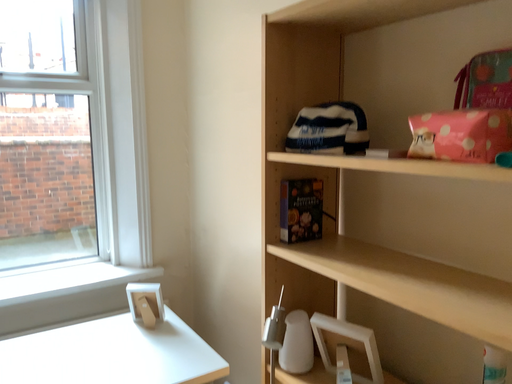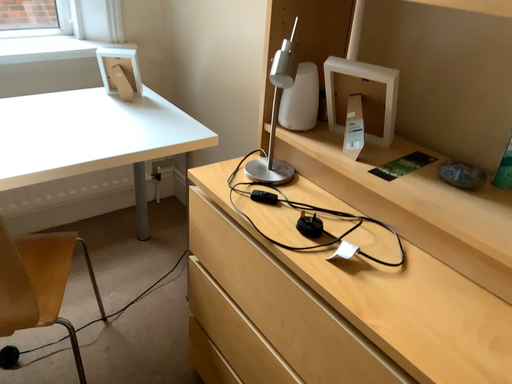
Question: Which way did the camera rotate in the video?

Choices:
 (A) rotated upward
 (B) rotated downward

Answer: (B)